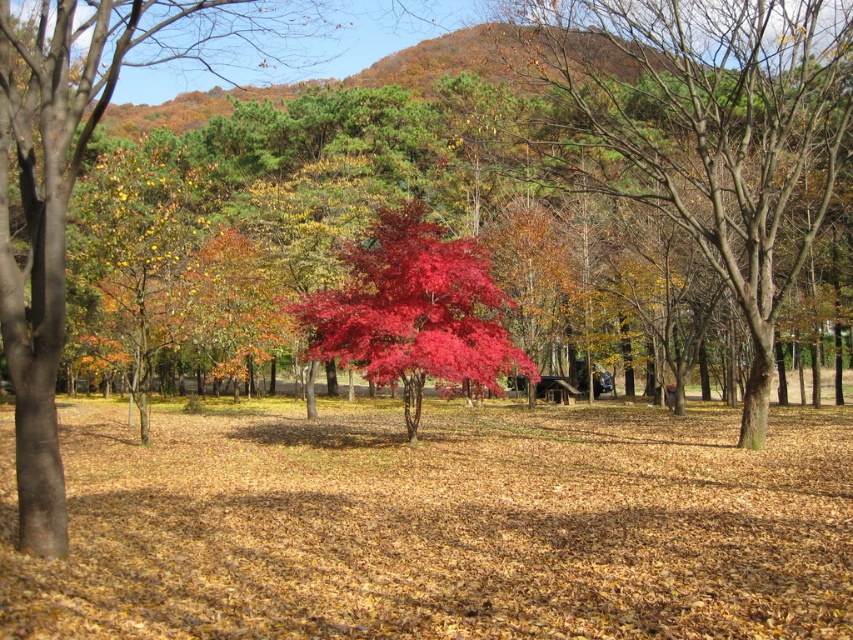
You are standing in the park and want to take a photo of the shiny red maple tree at center. If your camera has a maximum focus range of 50 feet, will you need to move closer to the tree to get a clear shot?

The shiny red maple tree at center is 58.25 feet away from the viewer. Since the camera can only focus up to 50 feet, you need to move closer to the tree to ensure it is within the camera range.

You are a painter setting up an easel in the middle of the autumn scene. You want to paint both the shiny red maple tree at center and the vivid crimson leaves at center. Which object should you focus on first if you want to paint the wider one?

The shiny red maple tree at center might be wider than vivid crimson leaves at center, so you should focus on painting the shiny red maple tree at center first.

You are standing in the autumn park and want to locate the shiny red maple tree at center. What are the coordinates where you should look?

The shiny red maple tree at center is located at coordinates point (x=705, y=129).